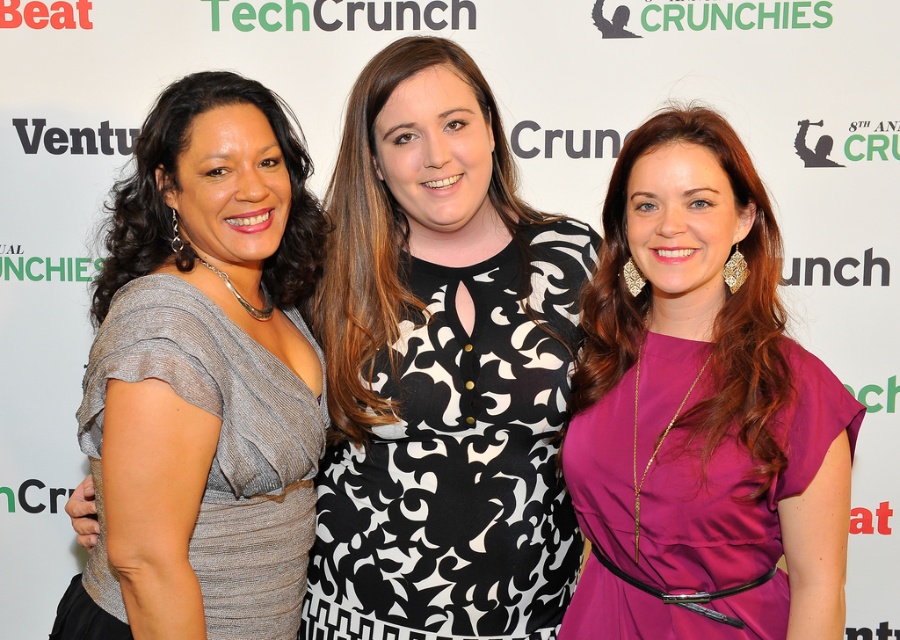
Question: Is the position of purple satin dress at center less distant than that of shiny silver dress at left?

Choices:
 (A) no
 (B) yes

Answer: (A)

Question: Can you confirm if purple satin dress at center is positioned below shiny silver dress at left?

Choices:
 (A) no
 (B) yes

Answer: (B)

Question: Which object is the farthest from the purple satin dress at center?

Choices:
 (A) shiny silver dress at left
 (B) black and white patterned dress at center

Answer: (A)

Question: Is black and white patterned dress at center positioned in front of purple satin dress at center?

Choices:
 (A) no
 (B) yes

Answer: (A)

Question: Which point is closer to the camera?

Choices:
 (A) (541, 452)
 (B) (684, 131)
 (C) (181, 488)

Answer: (C)

Question: Which of the following is the farthest from the observer?

Choices:
 (A) (586, 573)
 (B) (527, 595)

Answer: (B)